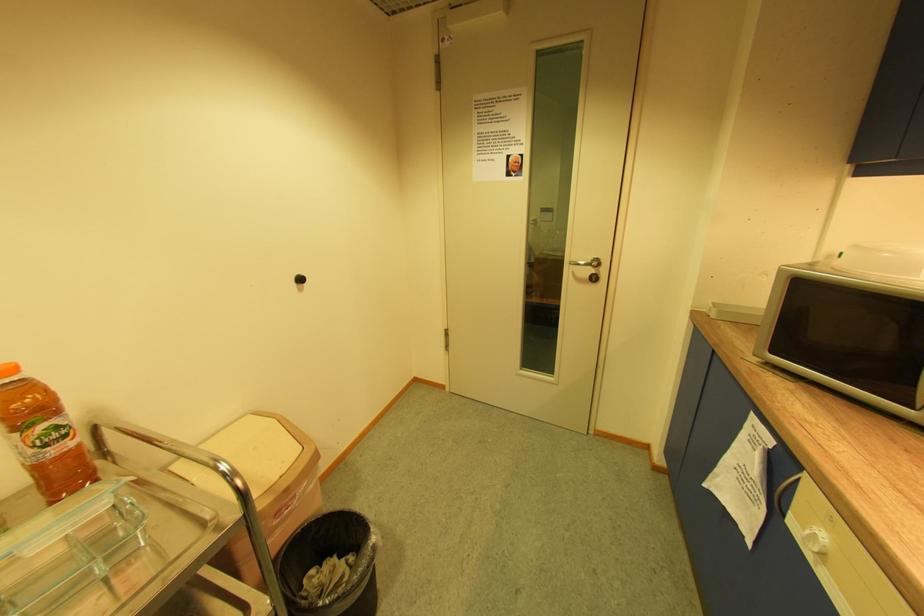
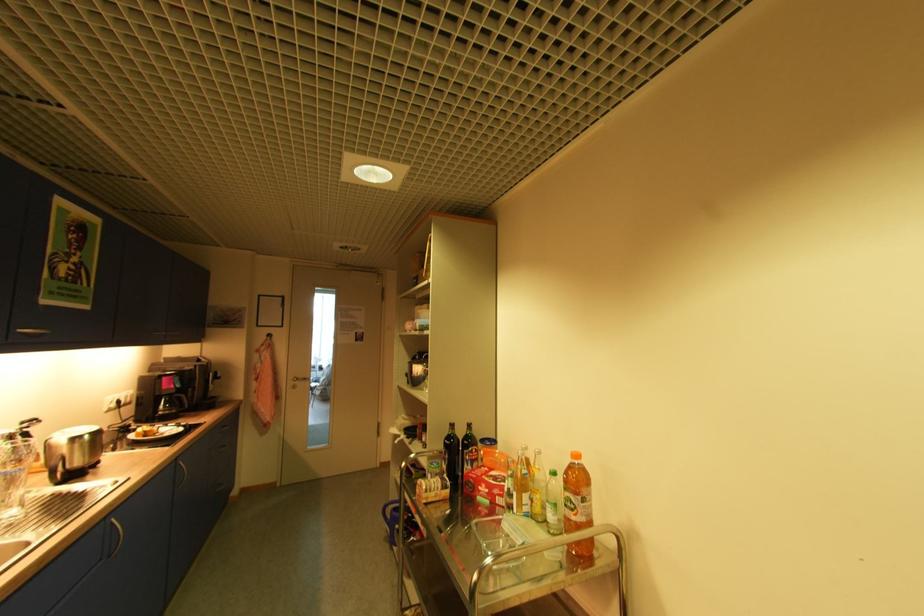
Where in the second image is the point corresponding to the point at 61,437 from the first image?

(575, 506)